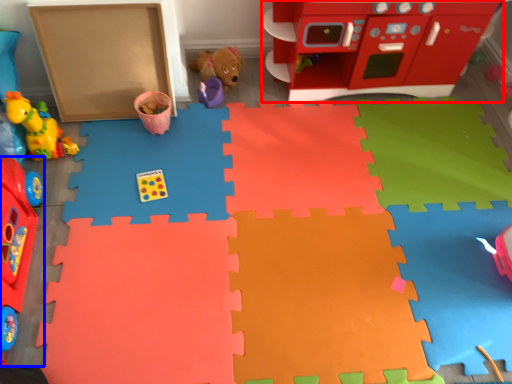
Question: Which object appears farthest to the camera in this image, toy (highlighted by a red box) or toy (highlighted by a blue box)?

Choices:
 (A) toy
 (B) toy

Answer: (A)